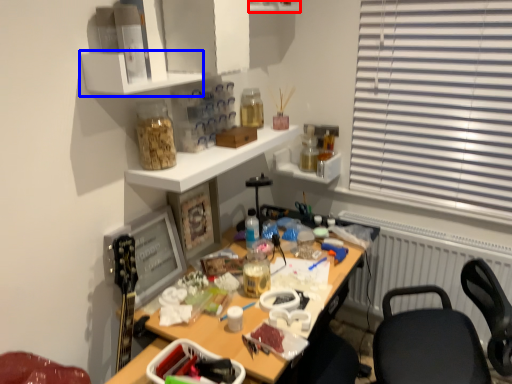
Question: Which object is further to the camera taking this photo, shelf (highlighted by a red box) or shelf (highlighted by a blue box)?

Choices:
 (A) shelf
 (B) shelf

Answer: (A)